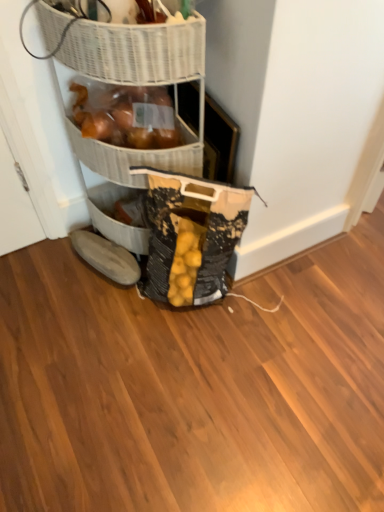
Question: Can you confirm if textured canvas bag at lower center is bigger than woven brown basket at upper center, which ranks as the 2th basket in front-to-back order?

Choices:
 (A) no
 (B) yes

Answer: (B)

Question: From the image's perspective, is textured canvas bag at lower center under woven brown basket at upper center, acting as the first basket starting from the back?

Choices:
 (A) yes
 (B) no

Answer: (A)

Question: Can you confirm if textured canvas bag at lower center is shorter than woven brown basket at upper center, acting as the first basket starting from the back?

Choices:
 (A) no
 (B) yes

Answer: (A)

Question: Is woven brown basket at upper center, acting as the first basket starting from the back, surrounded by textured canvas bag at lower center?

Choices:
 (A) yes
 (B) no

Answer: (B)

Question: From a real-world perspective, is textured canvas bag at lower center over woven brown basket at upper center, which ranks as the 2th basket in front-to-back order?

Choices:
 (A) no
 (B) yes

Answer: (A)

Question: Can you confirm if textured canvas bag at lower center is positioned to the right of woven brown basket at upper center, acting as the first basket starting from the back?

Choices:
 (A) yes
 (B) no

Answer: (A)

Question: From a real-world perspective, does woven brown basket at upper center, acting as the first basket starting from the back, sit lower than textured canvas bag at lower center?

Choices:
 (A) yes
 (B) no

Answer: (B)

Question: Considering the relative sizes of woven brown basket at upper center, acting as the first basket starting from the back, and textured canvas bag at lower center in the image provided, is woven brown basket at upper center, acting as the first basket starting from the back, smaller than textured canvas bag at lower center?

Choices:
 (A) yes
 (B) no

Answer: (A)

Question: Does woven brown basket at upper center, acting as the first basket starting from the back, have a larger size compared to textured canvas bag at lower center?

Choices:
 (A) yes
 (B) no

Answer: (B)

Question: Can you confirm if woven brown basket at upper center, acting as the first basket starting from the back, is positioned to the right of textured canvas bag at lower center?

Choices:
 (A) no
 (B) yes

Answer: (A)

Question: Can you see woven brown basket at upper center, which ranks as the 2th basket in front-to-back order, touching textured canvas bag at lower center?

Choices:
 (A) yes
 (B) no

Answer: (B)

Question: Is woven brown basket at upper center, which ranks as the 2th basket in front-to-back order, in front of textured canvas bag at lower center?

Choices:
 (A) yes
 (B) no

Answer: (B)

Question: Is textured canvas bag at lower center touching brown suede boot at lower left?

Choices:
 (A) no
 (B) yes

Answer: (A)